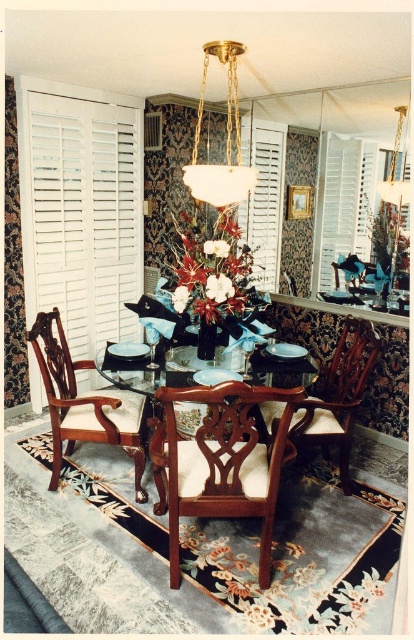
Is white wood shutter at left below white glass chandelier at center?

Yes, white wood shutter at left is below white glass chandelier at center.

From the picture: Is white wood shutter at left closer to camera compared to white glass chandelier at center?

No, white wood shutter at left is behind white glass chandelier at center.

Is point (21, 106) behind point (233, 88)?

No, it is in front of (233, 88).

This screenshot has width=414, height=640. Find the location of `white wood shutter at left`. white wood shutter at left is located at coordinates (81, 209).

The image size is (414, 640). What do you see at coordinates (221, 460) in the screenshot?
I see `mahogany wood chair at center` at bounding box center [221, 460].

Is point (272, 483) positioned behind point (238, 173)?

No, (272, 483) is in front of (238, 173).

Is point (211, 394) farther from camera compared to point (233, 88)?

That is False.

Identify the location of mahogany wood chair at center. (221, 460).

Describe the element at coordinates (81, 209) in the screenshot. I see `white wood shutter at left` at that location.

How much distance is there between white wood shutter at left and white wood shutter at upper center?

white wood shutter at left and white wood shutter at upper center are 3.92 feet apart.

Where is `white wood shutter at left`? white wood shutter at left is located at coordinates (81, 209).

Find the location of a particular element. white wood shutter at left is located at coordinates 81,209.